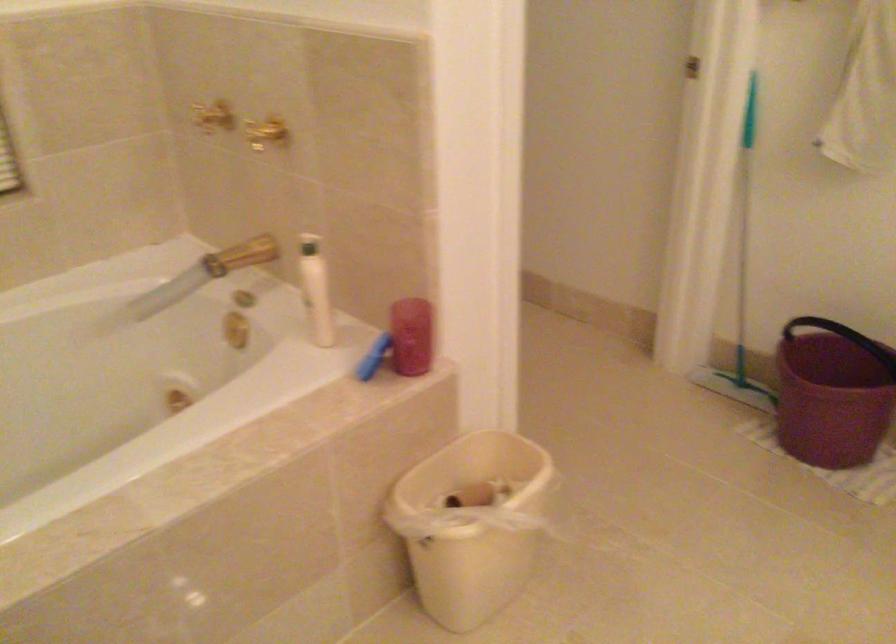
Describe the element at coordinates (833, 333) in the screenshot. This screenshot has width=896, height=644. I see `the black bucket handle` at that location.